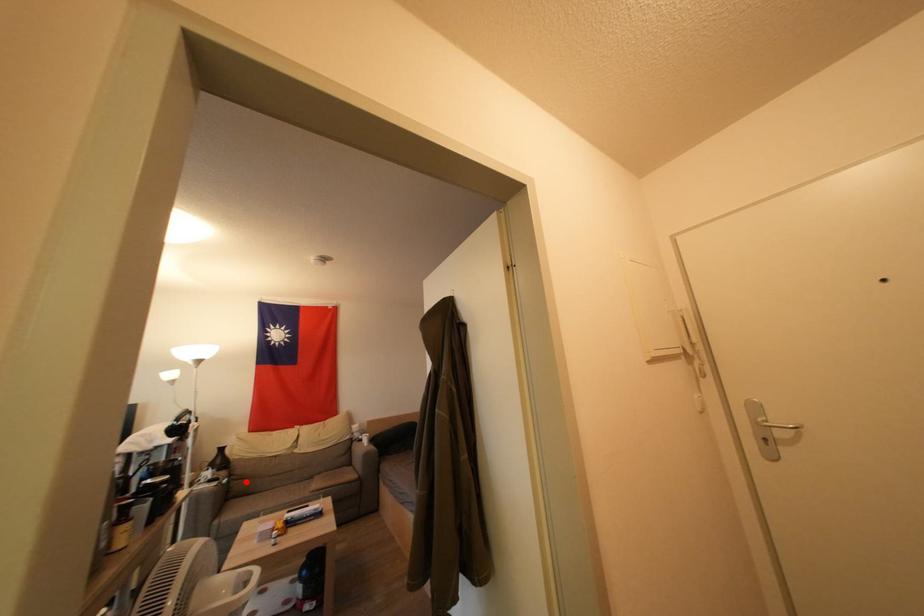
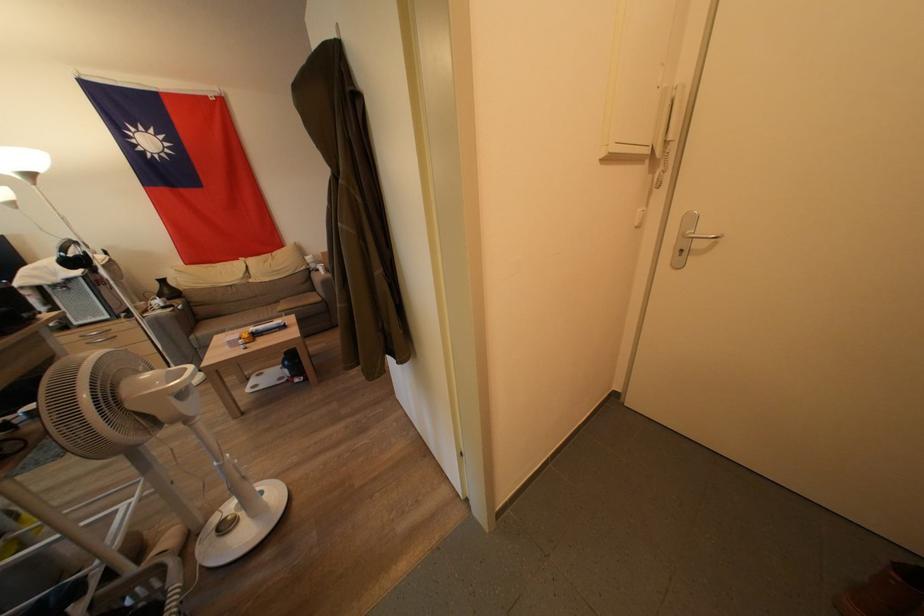
Find the pixel in the second image that matches the highlighted location in the first image.

(207, 309)